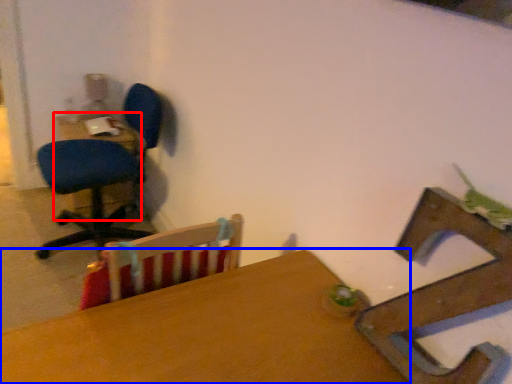
Question: Among these objects, which one is farthest to the camera, table (highlighted by a red box) or table (highlighted by a blue box)?

Choices:
 (A) table
 (B) table

Answer: (A)